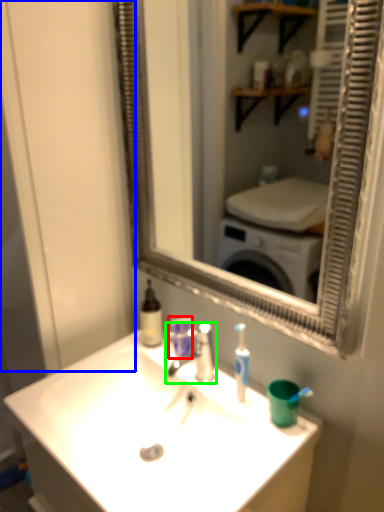
Question: Which is farther away from mouthwash (highlighted by a red box)? glass door (highlighted by a blue box) or tap (highlighted by a green box)?

Choices:
 (A) glass door
 (B) tap

Answer: (A)